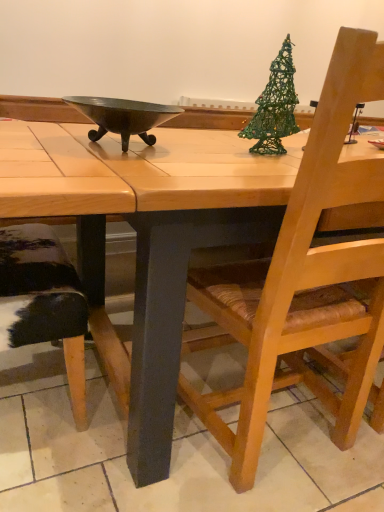
Locate an element on the screen. This screenshot has height=512, width=384. spots to the right of metallic dark gray bowl at center is located at coordinates (218, 156).